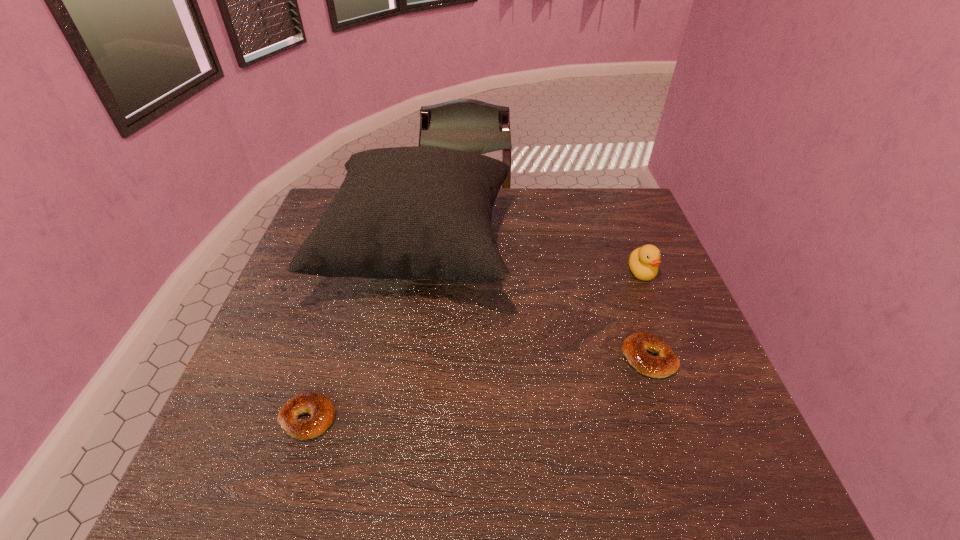
Find the location of `the tallest object`. the tallest object is located at coordinates (408, 213).

Image resolution: width=960 pixels, height=540 pixels. In order to click on the third shortest object in this screenshot , I will do `click(643, 262)`.

I want to click on the third farthest object, so click(x=635, y=346).

The image size is (960, 540). I want to click on the right bagel, so click(635, 346).

This screenshot has height=540, width=960. What are the coordinates of `the nearer bagel` in the screenshot? It's located at (316, 404).

Where is `the nearest object`? The width and height of the screenshot is (960, 540). the nearest object is located at coordinates (316, 404).

In order to click on blank space located on the right of the tallest object in this screenshot , I will do `click(644, 252)`.

At what (x,y) coordinates should I click in order to perform the action: click on vacant space located 0.070m at the beak of the third shortest object. Please return your answer as a coordinate pair (x, y). Looking at the image, I should click on (655, 305).

I want to click on free space located on the front of the farther bagel, so click(x=696, y=495).

Identify the location of vacant space located 0.400m on the back of the left bagel. (354, 269).